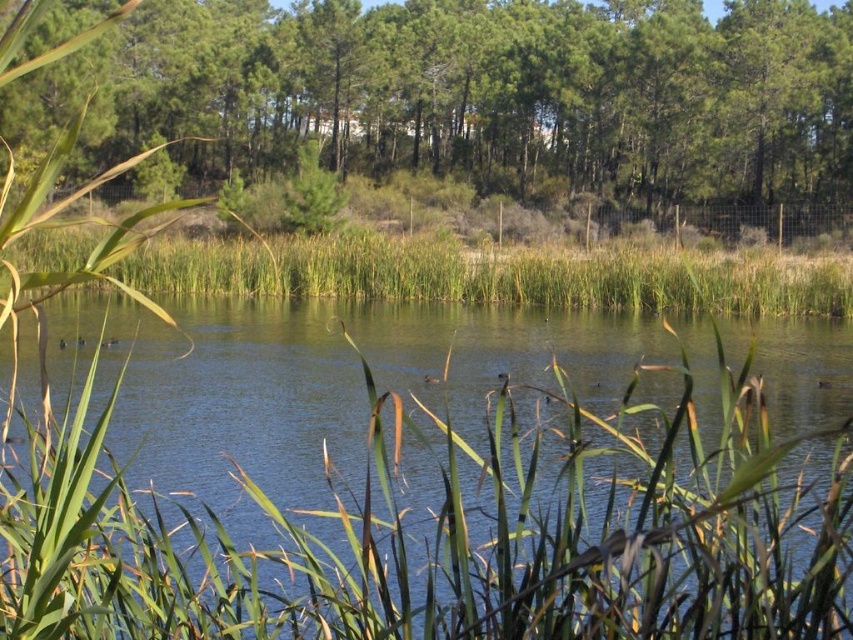
Question: Can you confirm if green leafy trees at upper center is positioned below green grass at center?

Choices:
 (A) yes
 (B) no

Answer: (B)

Question: Which point is closer to the camera?

Choices:
 (A) (425, 586)
 (B) (347, 276)
 (C) (553, 113)

Answer: (A)

Question: Does green leafy trees at upper center have a lesser width compared to green grass at center?

Choices:
 (A) yes
 (B) no

Answer: (B)

Question: Does green grassy lake at center lie behind green grass at center?

Choices:
 (A) no
 (B) yes

Answer: (A)

Question: Which object is farther from the camera taking this photo?

Choices:
 (A) green leafy trees at upper center
 (B) green grassy lake at center
 (C) green grass at center

Answer: (C)

Question: Which object is farther from the camera taking this photo?

Choices:
 (A) green leafy trees at upper center
 (B) green grassy lake at center
 (C) green grass at center

Answer: (C)